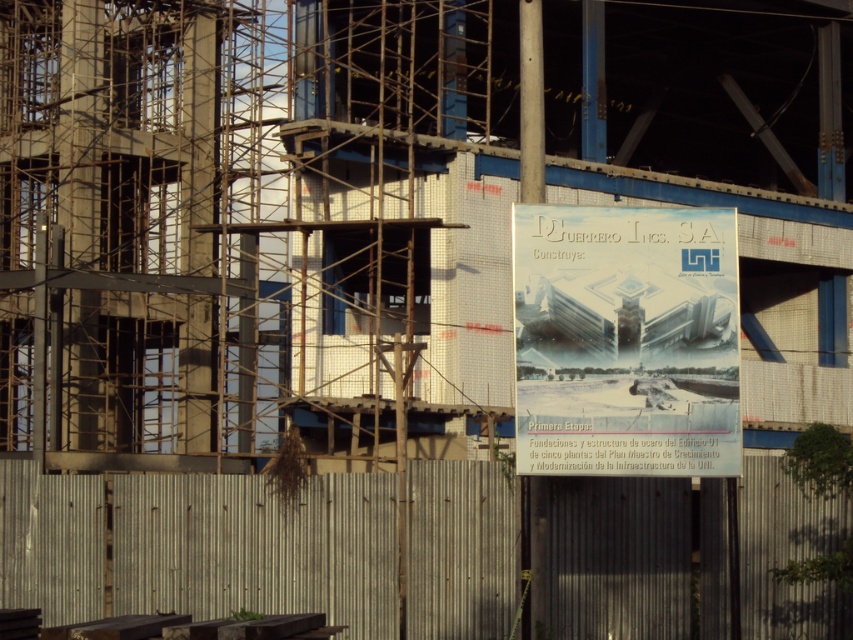
You are a delivery person trying to access the construction site. You see the metallic corrugated fence at lower center and the white paper poster at center. Which object is wider from your perspective?

The metallic corrugated fence at lower center might be wider than the white paper poster at center according to the description.

In the scene shown: You are a construction worker standing at the entrance of the site. You need to locate the white paper poster at center and the metallic corrugated fence at lower center. Which one is positioned to the left of the other?

The metallic corrugated fence at lower center is to the left of the white paper poster at center.